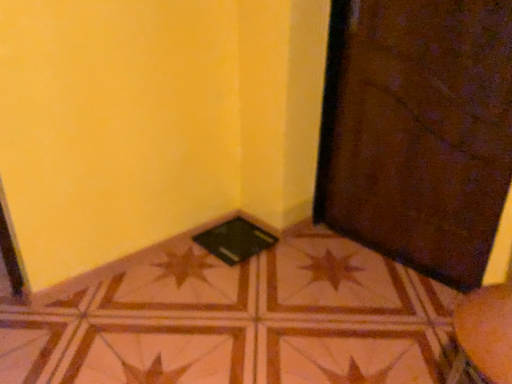
The width and height of the screenshot is (512, 384). What do you see at coordinates (234, 319) in the screenshot?
I see `brown glossy tile at center` at bounding box center [234, 319].

The width and height of the screenshot is (512, 384). Describe the element at coordinates (418, 131) in the screenshot. I see `brown textured door at lower right` at that location.

At what (x,y) coordinates should I click in order to perform the action: click on black matte pad at lower center. Please return your answer as a coordinate pair (x, y). The height and width of the screenshot is (384, 512). Looking at the image, I should click on (234, 240).

I want to click on brown glossy tile at center, so click(x=234, y=319).

From a real-world perspective, relative to brown textured door at lower right, is brown glossy tile at center vertically above or below?

Clearly, from a real-world perspective, brown glossy tile at center is below brown textured door at lower right.

Is brown glossy tile at center bigger or smaller than brown textured door at lower right?

Clearly, brown glossy tile at center is larger in size than brown textured door at lower right.

Looking at this image, is brown glossy tile at center touching brown textured door at lower right?

brown glossy tile at center is not next to brown textured door at lower right, and they're not touching.

Can you confirm if brown glossy tile at center is thinner than brown textured door at lower right?

No.

Is point (226, 221) positioned behind point (47, 314)?

Yes, point (226, 221) is behind point (47, 314).

From a real-world perspective, which is physically below, black matte pad at lower center or brown glossy tile at center?

From a 3D spatial view, brown glossy tile at center is below.

Is black matte pad at lower center inside the boundaries of brown glossy tile at center, or outside?

black matte pad at lower center is enclosed within brown glossy tile at center.

Considering the sizes of objects black matte pad at lower center and brown glossy tile at center in the image provided, who is shorter, black matte pad at lower center or brown glossy tile at center?

black matte pad at lower center is shorter.

Consider the image. Is black matte pad at lower center wider or thinner than brown textured door at lower right?

In the image, black matte pad at lower center appears to be wider than brown textured door at lower right.

Who is taller, black matte pad at lower center or brown textured door at lower right?

Result: brown textured door at lower right.

Which is behind, point (251, 231) or point (330, 224)?

The point (251, 231) is more distant.

Is black matte pad at lower center smaller than brown textured door at lower right?

Yes, black matte pad at lower center is smaller than brown textured door at lower right.

From the image's perspective, who appears lower, brown textured door at lower right or brown glossy tile at center?

brown glossy tile at center.

Choose the correct answer: Is brown textured door at lower right inside brown glossy tile at center or outside it?

brown textured door at lower right cannot be found inside brown glossy tile at center.

How different are the orientations of brown textured door at lower right and brown glossy tile at center in degrees?

brown textured door at lower right and brown glossy tile at center are facing 82.5 degrees away from each other.

Does brown textured door at lower right come behind brown glossy tile at center?

Yes.

Is brown textured door at lower right outside of black matte pad at lower center?

Yes, brown textured door at lower right is outside of black matte pad at lower center.

Is brown textured door at lower right to the left or to the right of black matte pad at lower center in the image?

Clearly, brown textured door at lower right is on the right of black matte pad at lower center in the image.

From the image's perspective, which is above, brown textured door at lower right or black matte pad at lower center?

brown textured door at lower right, from the image's perspective.

At what (x,y) coordinates should I click in order to perform the action: click on door in front of the black matte pad at lower center. Please return your answer as a coordinate pair (x, y). The width and height of the screenshot is (512, 384). Looking at the image, I should click on (418, 131).

Is brown glossy tile at center far away from black matte pad at lower center?

That's not correct — brown glossy tile at center is a little close to black matte pad at lower center.

From the image's perspective, which one is positioned higher, brown glossy tile at center or black matte pad at lower center?

black matte pad at lower center, from the image's perspective.

Which is more to the left, brown glossy tile at center or black matte pad at lower center?

Positioned to the left is black matte pad at lower center.

Consider the image. Is brown glossy tile at center surrounding black matte pad at lower center?

Yes.

Find the location of a particular element. The height and width of the screenshot is (384, 512). tile on the left of brown textured door at lower right is located at coordinates (234, 319).

Locate an element on the screen. The height and width of the screenshot is (384, 512). tile located on the right of black matte pad at lower center is located at coordinates (234, 319).

In the scene shown: Which object lies nearer to the anchor point brown textured door at lower right, brown glossy tile at center or black matte pad at lower center?

brown glossy tile at center is closer to brown textured door at lower right.

From the image, which object appears to be nearer to black matte pad at lower center, brown glossy tile at center or brown textured door at lower right?

brown glossy tile at center is closer to black matte pad at lower center.

When comparing their distances from brown glossy tile at center, does brown textured door at lower right or black matte pad at lower center seem closer?

Based on the image, black matte pad at lower center appears to be nearer to brown glossy tile at center.

From the picture: Looking at the image, which one is located further to black matte pad at lower center, brown textured door at lower right or brown glossy tile at center?

brown textured door at lower right is further to black matte pad at lower center.

When comparing their distances from brown glossy tile at center, does black matte pad at lower center or brown textured door at lower right seem further?

brown textured door at lower right.

Estimate the real-world distances between objects in this image. Which object is further from brown textured door at lower right, black matte pad at lower center or brown glossy tile at center?

The object further to brown textured door at lower right is black matte pad at lower center.

This screenshot has height=384, width=512. Find the location of `door between brown glossy tile at center and black matte pad at lower center in the front-back direction`. door between brown glossy tile at center and black matte pad at lower center in the front-back direction is located at coordinates (418, 131).